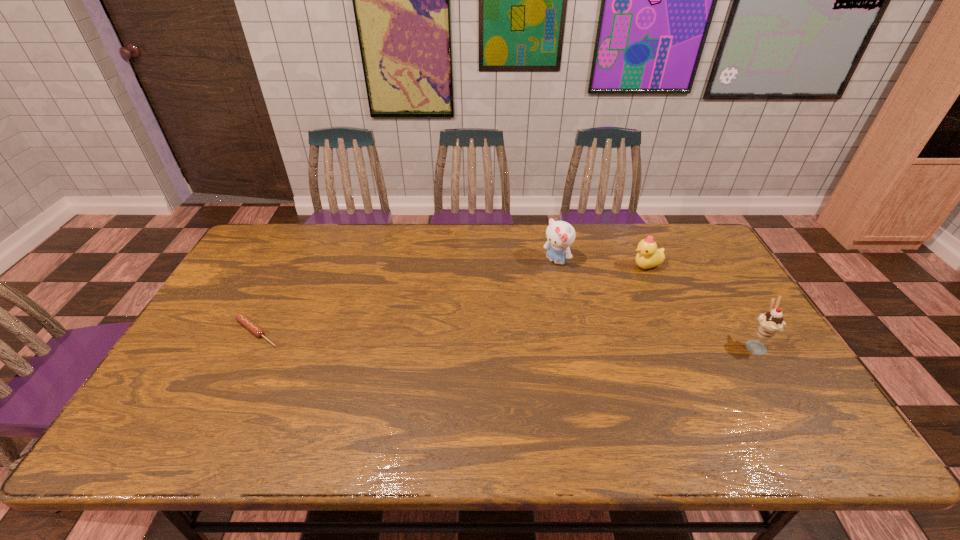
At what (x,y) coordinates should I click in order to perform the action: click on free point located 0.340m on the front-facing side of the second object from left to right. Please return your answer as a coordinate pair (x, y). The width and height of the screenshot is (960, 540). Looking at the image, I should click on (x=479, y=329).

This screenshot has height=540, width=960. Find the location of `free region located 0.280m on the front-facing side of the second shortest object`. free region located 0.280m on the front-facing side of the second shortest object is located at coordinates (578, 310).

Find the location of `free space located 0.060m on the front-facing side of the second shortest object`. free space located 0.060m on the front-facing side of the second shortest object is located at coordinates (624, 279).

The image size is (960, 540). I want to click on free space located on the front-facing side of the second shortest object, so click(564, 320).

Where is `kitten that is at the far edge`? This screenshot has width=960, height=540. kitten that is at the far edge is located at coordinates (560, 235).

Where is `duckling at the far edge`? This screenshot has width=960, height=540. duckling at the far edge is located at coordinates (648, 256).

Locate an element on the screen. The width and height of the screenshot is (960, 540). object at the left edge is located at coordinates (242, 319).

Where is `object that is positioned at the right edge`? object that is positioned at the right edge is located at coordinates (772, 322).

You are a GUI agent. You are given a task and a screenshot of the screen. Output one action in this format:
    pyautogui.click(x=<x>, y=<y>)
    Task: Click on the vacant space at the far edge of the desktop
    Image resolution: width=960 pixels, height=540 pixels.
    Given the screenshot: What is the action you would take?
    pyautogui.click(x=500, y=233)

Where is `free space at the near edge of the desktop`? This screenshot has width=960, height=540. free space at the near edge of the desktop is located at coordinates (495, 392).